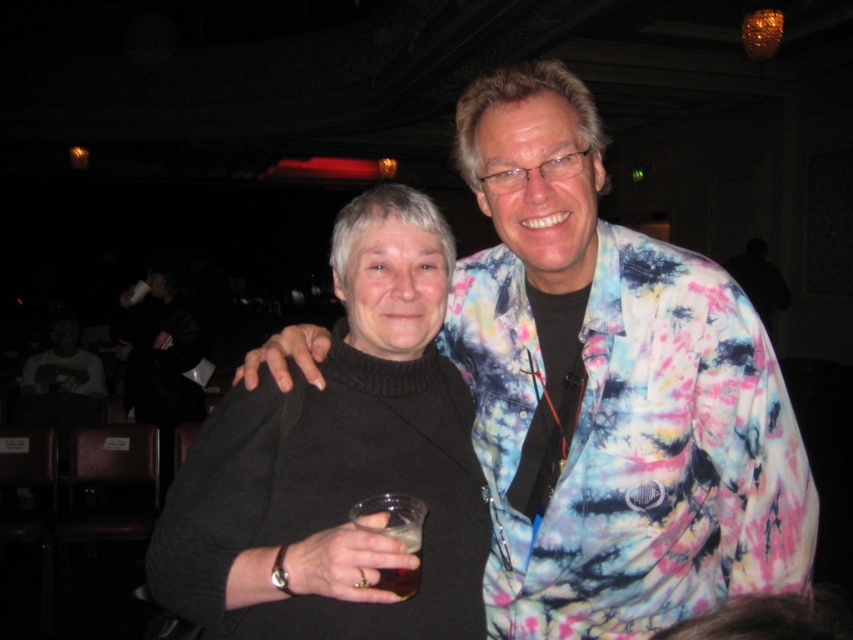
Does tie-dye jacket at center appear on the right side of translucent glass at lower center?

Indeed, tie-dye jacket at center is positioned on the right side of translucent glass at lower center.

Describe the element at coordinates (610, 392) in the screenshot. I see `tie-dye jacket at center` at that location.

Between point (525, 262) and point (412, 570), which one is positioned in front?

Positioned in front is point (412, 570).

Image resolution: width=853 pixels, height=640 pixels. What are the coordinates of `tie-dye jacket at center` in the screenshot? It's located at (610, 392).

Is point (492, 508) positioned behind point (161, 540)?

That is True.

Does tie-dye jacket at center appear on the right side of black sweater at center?

Yes, tie-dye jacket at center is to the right of black sweater at center.

Who is more forward, (514, 234) or (376, 225)?

Point (514, 234) is more forward.

Locate an element on the screen. tie-dye jacket at center is located at coordinates (610, 392).

Can you confirm if black sweater at center is positioned below translucent glass at lower center?

No.

Which is below, black sweater at center or translucent glass at lower center?

Positioned lower is translucent glass at lower center.

Measure the distance between black sweater at center and camera.

black sweater at center and camera are 96.49 centimeters apart from each other.

What are the coordinates of `black sweater at center` in the screenshot? It's located at (338, 465).